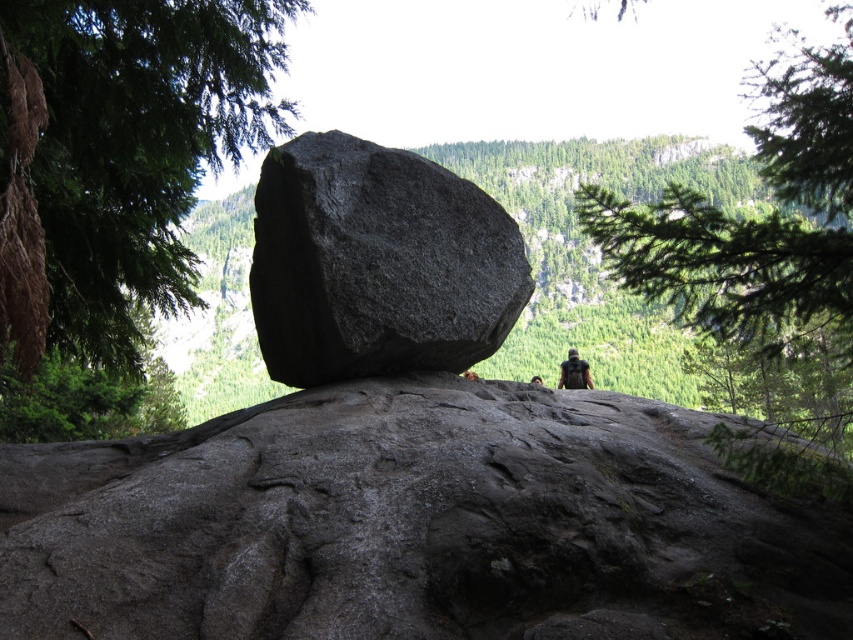
Question: Is dark gray granite boulder at center to the left of green leafy branch at upper right from the viewer's perspective?

Choices:
 (A) no
 (B) yes

Answer: (B)

Question: Which object appears farthest from the camera in this image?

Choices:
 (A) green leafy tree at upper left
 (B) dark green fabric backpack at center
 (C) green leafy branch at upper right
 (D) brown leather backpack at center

Answer: (B)

Question: Which of these objects is positioned farthest from the green leafy tree at upper left?

Choices:
 (A) brown leather backpack at center
 (B) dark gray granite boulder at center

Answer: (A)

Question: Which point is closer to the camera taking this photo?

Choices:
 (A) (817, 381)
 (B) (531, 378)

Answer: (A)

Question: Is the position of green leafy branch at upper right more distant than that of brown leather backpack at center?

Choices:
 (A) yes
 (B) no

Answer: (B)

Question: Observing the image, what is the correct spatial positioning of green leafy tree at upper left in reference to dark green fabric backpack at center?

Choices:
 (A) left
 (B) right

Answer: (A)